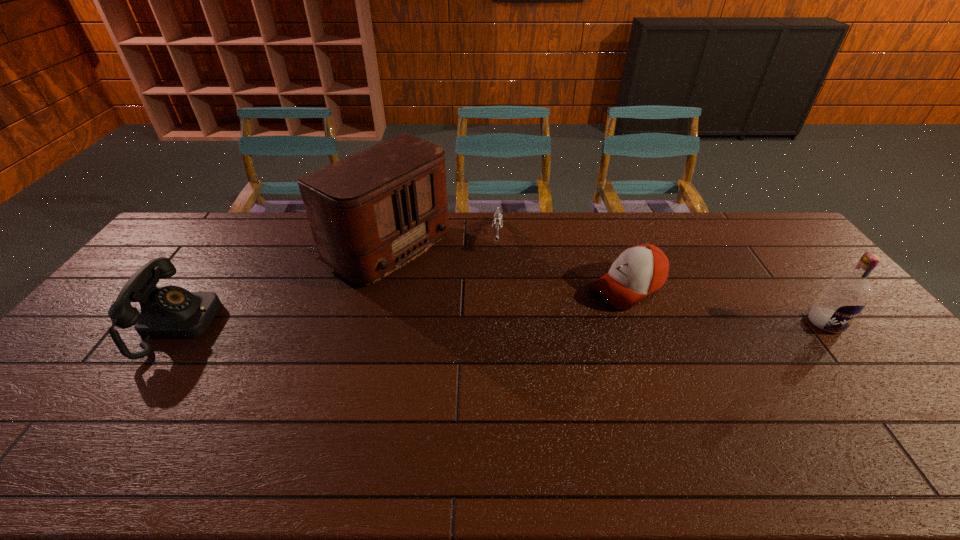
Locate an element on the screen. vacant space located 0.120m aimed along the barrel of the gun is located at coordinates (496, 277).

Find the location of a particular element. radio receiver that is at the far edge is located at coordinates (371, 213).

Find the location of a particular element. gun that is at the far edge is located at coordinates [x=497, y=221].

You are a GUI agent. You are given a task and a screenshot of the screen. Output one action in this format:
    pyautogui.click(x=<x>, y=<y>)
    Task: Click on the object situated at the left edge
    
    Given the screenshot: What is the action you would take?
    pyautogui.click(x=166, y=312)

Where is `object positioned at the right edge`? Image resolution: width=960 pixels, height=540 pixels. object positioned at the right edge is located at coordinates (845, 295).

At what (x,y) coordinates should I click in order to perform the action: click on vacant region at the far edge of the desktop. Please return your answer as a coordinate pair (x, y). Looking at the image, I should click on (267, 216).

Where is `vacant area at the near edge`? The height and width of the screenshot is (540, 960). vacant area at the near edge is located at coordinates (180, 408).

The image size is (960, 540). Identify the location of free space at the right edge of the desktop. (853, 328).

Locate an element on the screen. The height and width of the screenshot is (540, 960). blank space at the near right corner of the desktop is located at coordinates click(x=890, y=421).

Locate an element on the screen. vacant space that is in between the tallest object and the second shortest object is located at coordinates (501, 267).